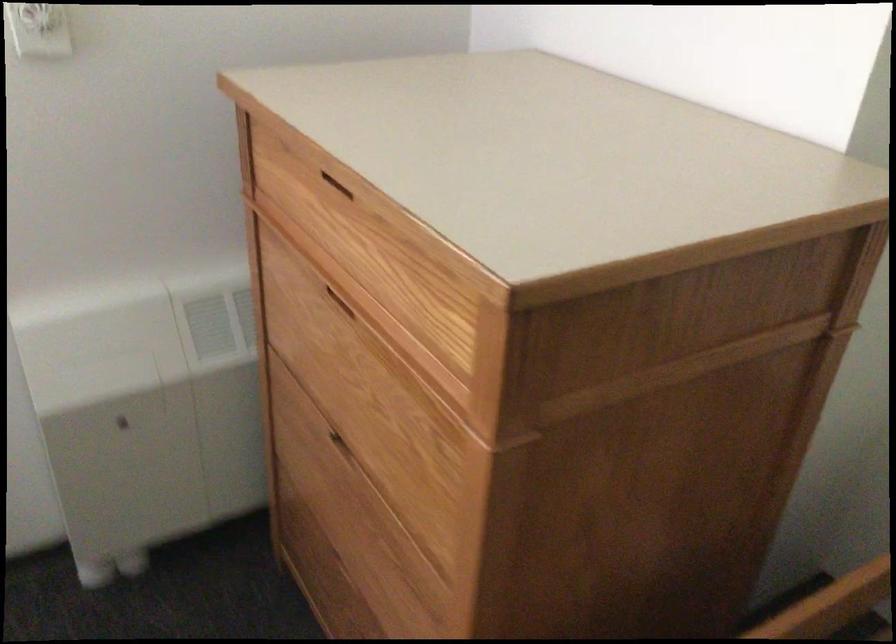
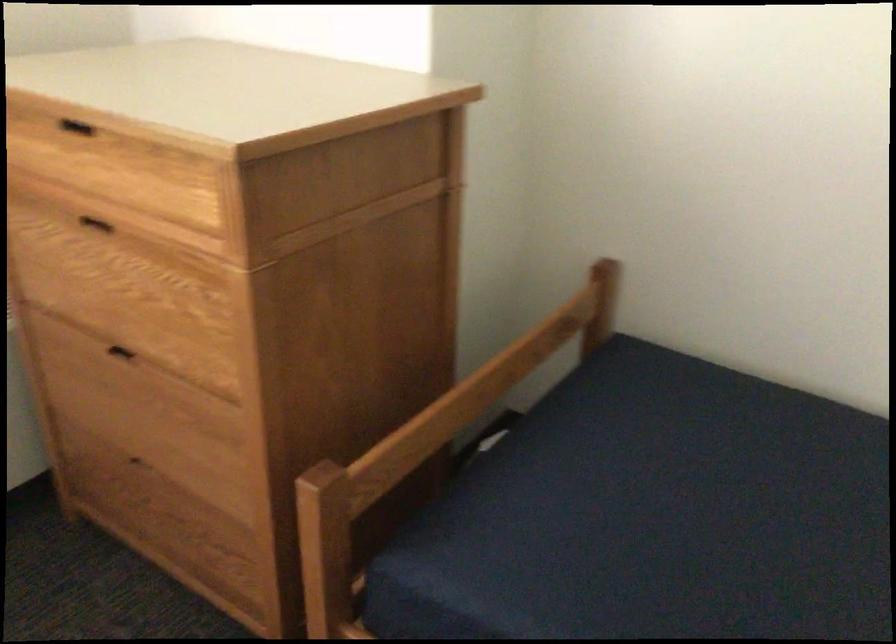
Where in the second image is the point corresponding to pixel 330 178 from the first image?

(75, 127)